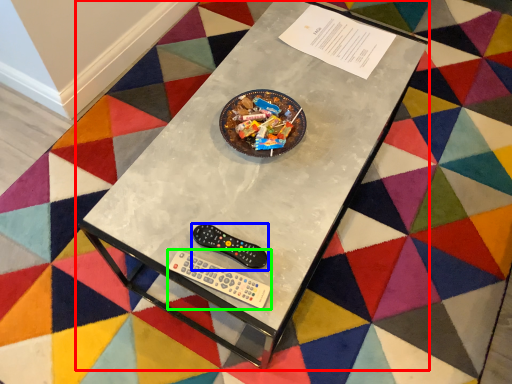
Question: Estimate the real-world distances between objects in this image. Which object is farther from table (highlighted by a red box), control (highlighted by a blue box) or Wii controller (highlighted by a green box)?

Choices:
 (A) control
 (B) Wii controller

Answer: (B)